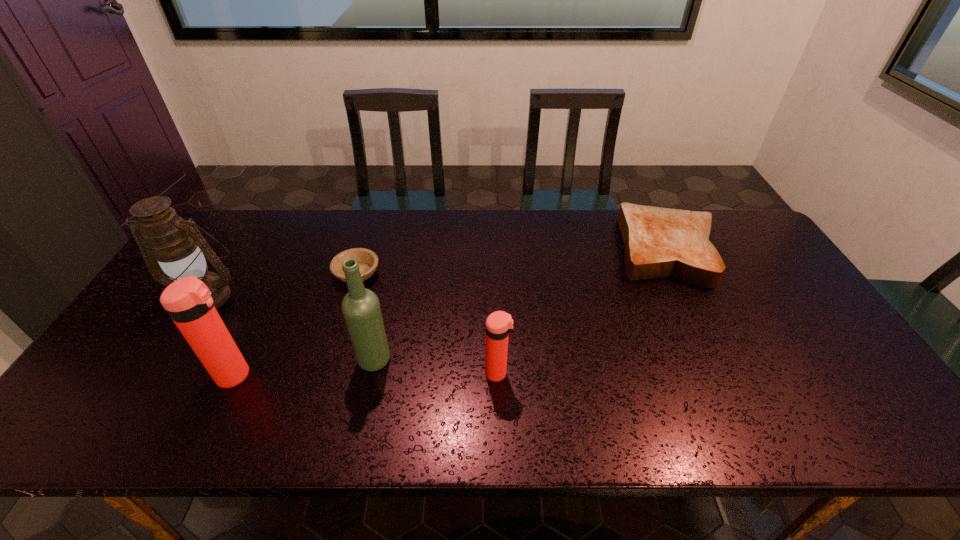
Find the location of a particular element. vacant area located 0.200m on the back of the right thermos bottle is located at coordinates (495, 305).

The height and width of the screenshot is (540, 960). I want to click on vacant area located 0.260m on the front of the bread, so click(x=722, y=363).

Image resolution: width=960 pixels, height=540 pixels. What are the coordinates of `vacant space located on the left of the bowl` in the screenshot? It's located at (310, 274).

The height and width of the screenshot is (540, 960). In order to click on vacant area situated on the right of the wine bottle in this screenshot , I will do `click(432, 360)`.

In order to click on free space located on the front of the leftmost object in this screenshot , I will do coord(183,330).

You are a GUI agent. You are given a task and a screenshot of the screen. Output one action in this format:
    pyautogui.click(x=<x>, y=<y>)
    Task: Click on the object that is at the far edge
    This screenshot has width=960, height=540.
    Given the screenshot: What is the action you would take?
    pyautogui.click(x=659, y=242)

Where is `wine bottle located in the near edge section of the desktop`? wine bottle located in the near edge section of the desktop is located at coordinates (361, 309).

Where is `object positioned at the left edge`? The width and height of the screenshot is (960, 540). object positioned at the left edge is located at coordinates (177, 245).

You are a GUI agent. You are given a task and a screenshot of the screen. Output one action in this format:
    pyautogui.click(x=<x>, y=<y>)
    Task: Click on the object located at the right edge
    Image resolution: width=960 pixels, height=540 pixels.
    Given the screenshot: What is the action you would take?
    pyautogui.click(x=659, y=242)

The image size is (960, 540). I want to click on object positioned at the far right corner, so click(659, 242).